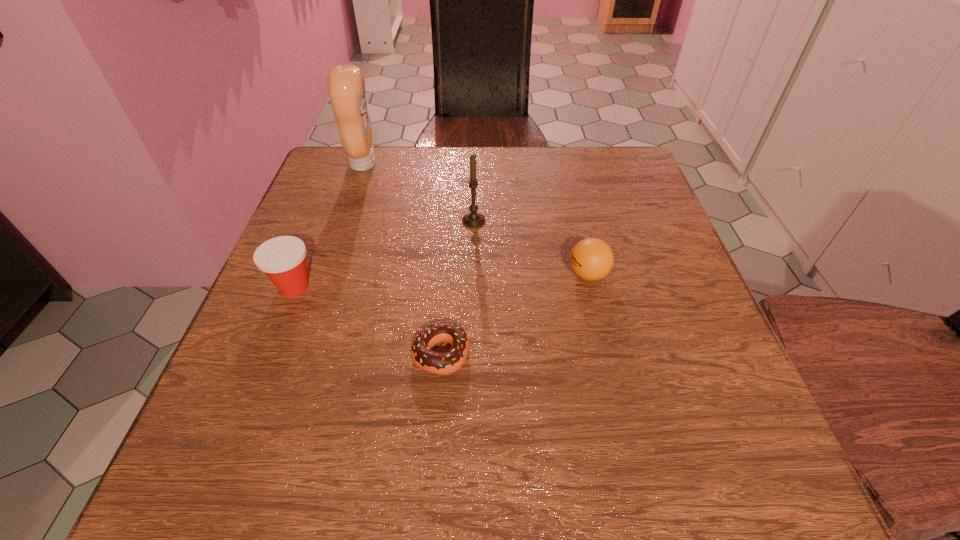
The width and height of the screenshot is (960, 540). Find the location of `vacant space at the far edge of the desktop`. vacant space at the far edge of the desktop is located at coordinates (463, 174).

Locate an element on the screen. Image resolution: width=960 pixels, height=540 pixels. vacant region at the near edge of the desktop is located at coordinates (504, 444).

This screenshot has width=960, height=540. In order to click on vacant space at the left edge of the desktop in this screenshot , I will do `click(301, 370)`.

This screenshot has width=960, height=540. I want to click on free space at the right edge, so click(634, 204).

I want to click on vacant space at the far left corner, so click(363, 193).

You are a GUI agent. You are given a task and a screenshot of the screen. Output one action in this format:
    pyautogui.click(x=<x>, y=<y>)
    Task: Click on the vacant area that lies between the Dixie cup and the tallest object
    The height and width of the screenshot is (540, 960).
    Given the screenshot: What is the action you would take?
    pyautogui.click(x=328, y=225)

This screenshot has height=540, width=960. What are the coordinates of `free space between the Dixie cup and the shortest object` in the screenshot? It's located at (368, 320).

Locate an element on the screen. The width and height of the screenshot is (960, 540). free space that is in between the Dixie cup and the farthest object is located at coordinates (328, 225).

This screenshot has width=960, height=540. In order to click on blank region between the rightmost object and the second tallest object in this screenshot , I will do `click(531, 247)`.

The width and height of the screenshot is (960, 540). I want to click on vacant area that lies between the candle and the ping-pong ball, so click(x=531, y=247).